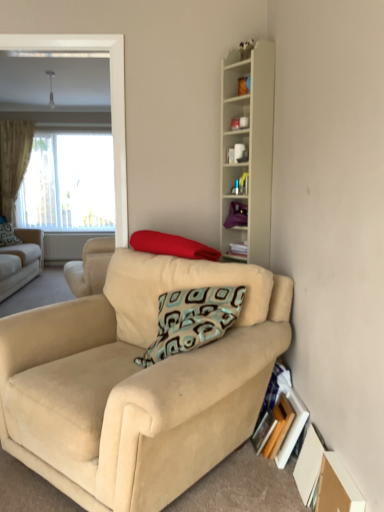
Question: From the image's perspective, is beige suede studio couch at center, which is the second studio couch in back-to-front order, positioned above or below red fabric pillow at center, placed as the 1th pillow when sorted from right to left?

Choices:
 (A) above
 (B) below

Answer: (B)

Question: Considering the positions of beige suede studio couch at center, marked as the second studio couch in a left-to-right arrangement, and red fabric pillow at center, the 1th pillow positioned from the front, in the image, is beige suede studio couch at center, marked as the second studio couch in a left-to-right arrangement, bigger or smaller than red fabric pillow at center, the 1th pillow positioned from the front,?

Choices:
 (A) small
 (B) big

Answer: (B)

Question: Estimate the real-world distances between objects in this image. Which object is farther from the red fabric pillow at center, which ranks as the first pillow in bottom-to-top order?

Choices:
 (A) patterned fabric pillow at left, the second pillow from the right
 (B) white matte cabinet at upper right
 (C) white matte mug at upper center, which ranks as the 2th cabinet in bottom-to-top order
 (D) beige textured curtain at left
 (E) brown cardboard box at lower right

Answer: (D)

Question: Which of these objects is positioned farthest from the beige fabric couch at left, which is the 1th studio couch from left to right?

Choices:
 (A) beige textured curtain at left
 (B) brown cardboard box at lower right
 (C) teal plastic cup at upper center
 (D) purple fabric at upper center, arranged as the 1th cabinet when ordered from the bottom
 (E) white matte mug at upper center, which ranks as the 2th cabinet in bottom-to-top order

Answer: (B)